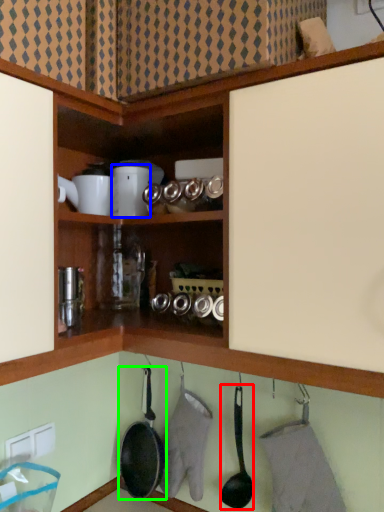
Question: Considering the real-world distances, which object is closest to frying pan (highlighted by a red box)? appliance (highlighted by a blue box) or frying pan (highlighted by a green box).

Choices:
 (A) appliance
 (B) frying pan

Answer: (B)